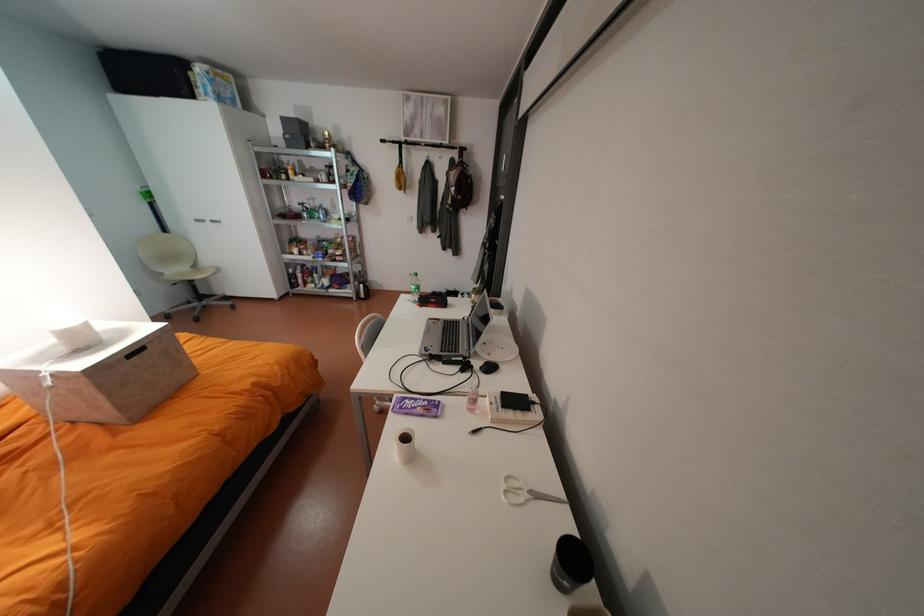
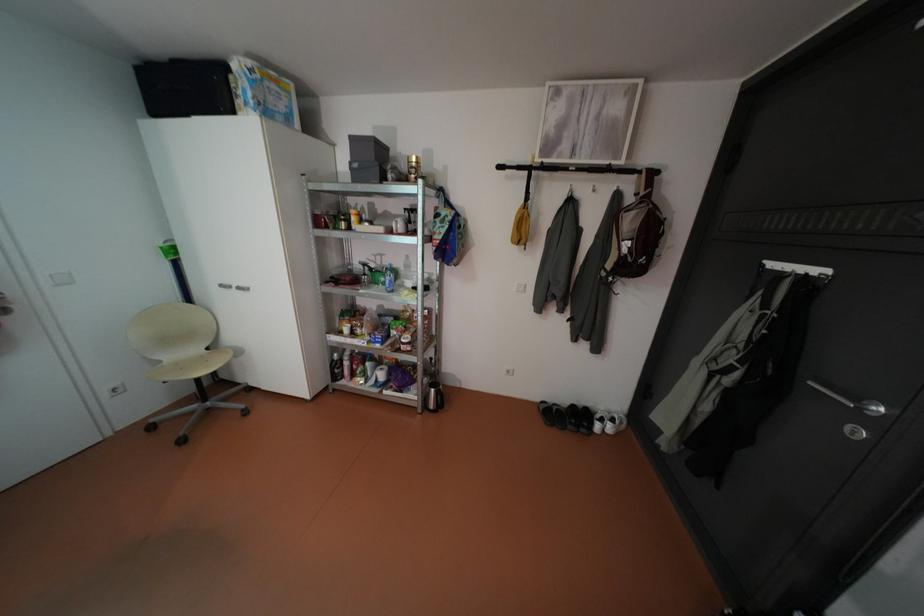
The point at (205, 220) is marked in the first image. Where is the corresponding point in the second image?

(232, 285)